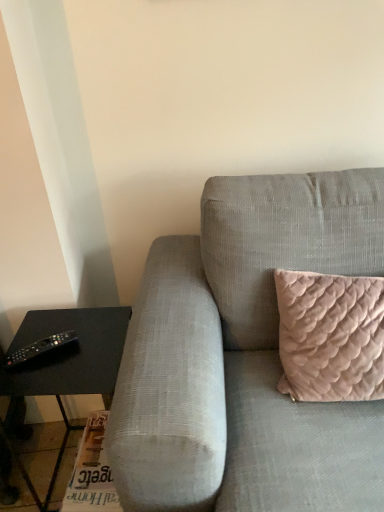
The width and height of the screenshot is (384, 512). What are the coordinates of `black matte table at left` in the screenshot? It's located at (65, 364).

Where is `black matte table at left`? The width and height of the screenshot is (384, 512). black matte table at left is located at coordinates (65, 364).

What's the angular difference between black matte table at left and textured gray couch at center's facing directions?

There is a 0.264-degree angle between the facing directions of black matte table at left and textured gray couch at center.

Find the location of a particular element. This screenshot has width=384, height=512. studio couch lying above the black matte table at left (from the image's perspective) is located at coordinates (245, 356).

Which of these two, black matte table at left or textured gray couch at center, stands taller?

With more height is textured gray couch at center.

From a real-world perspective, is black matte table at left on textured gray couch at center?

Incorrect, from a real-world perspective, black matte table at left is lower than textured gray couch at center.

From a real-world perspective, which is physically above, black plastic remote at lower left or textured gray couch at center?

In real-world perspective, black plastic remote at lower left is above.

Does point (71, 338) appear closer or farther from the camera than point (335, 417)?

Point (71, 338) appears to be farther away from the viewer than point (335, 417).

Can you confirm if black plastic remote at lower left is thinner than textured gray couch at center?

Indeed, black plastic remote at lower left has a lesser width compared to textured gray couch at center.

Are black plastic remote at lower left and textured gray couch at center making contact?

No, black plastic remote at lower left is not making contact with textured gray couch at center.

Does point (68, 340) come behind point (70, 344)?

No.

Is black plastic remote at lower left positioned behind black matte table at left?

Yes, it is behind black matte table at left.

Considering the sizes of black matte table at left and black plastic remote at lower left in the image, is black matte table at left taller or shorter than black plastic remote at lower left?

Considering their sizes, black matte table at left has more height than black plastic remote at lower left.

Are black matte table at left and black plastic remote at lower left making contact?

black matte table at left and black plastic remote at lower left are not in contact.

Based on the photo, is black matte table at left oriented away from black plastic remote at lower left?

black matte table at left is not turned away from black plastic remote at lower left.

Considering the positions of point (38, 362) and point (51, 337), is point (38, 362) closer or farther from the camera than point (51, 337)?

Clearly, point (38, 362) is closer to the camera than point (51, 337).

Could black plastic remote at lower left be considered to be inside textured gray couch at center?

No, textured gray couch at center does not contain black plastic remote at lower left.

Does textured gray couch at center have a lesser width compared to black plastic remote at lower left?

In fact, textured gray couch at center might be wider than black plastic remote at lower left.

Is textured gray couch at center oriented away from black plastic remote at lower left?

No, black plastic remote at lower left is not at the back of textured gray couch at center.

Are textured gray couch at center and black plastic remote at lower left making contact?

No, textured gray couch at center is not making contact with black plastic remote at lower left.

Between point (234, 313) and point (25, 391), which one is positioned in front?

The point (25, 391) is more forward.

Is textured gray couch at center smaller than black matte table at left?

No, textured gray couch at center is not smaller than black matte table at left.

Which is more to the left, textured gray couch at center or black matte table at left?

black matte table at left is more to the left.

From a real-world perspective, does textured gray couch at center stand above black matte table at left?

Correct, in the physical world, textured gray couch at center is higher than black matte table at left.

The image size is (384, 512). In order to click on table on the left of textured gray couch at center in this screenshot , I will do `click(65, 364)`.

Image resolution: width=384 pixels, height=512 pixels. I want to click on remote behind the textured gray couch at center, so click(40, 348).

Considering their positions, is black plastic remote at lower left positioned closer to black matte table at left than textured gray couch at center?

Among the two, black plastic remote at lower left is located nearer to black matte table at left.

Estimate the real-world distances between objects in this image. Which object is closer to black plastic remote at lower left, black matte table at left or textured gray couch at center?

black matte table at left is positioned closer to the anchor black plastic remote at lower left.

Considering their positions, is black matte table at left positioned further to textured gray couch at center than black plastic remote at lower left?

black plastic remote at lower left is further to textured gray couch at center.

From the image, which object appears to be nearer to black plastic remote at lower left, textured gray couch at center or black matte table at left?

black matte table at left.

When comparing their distances from black matte table at left, does textured gray couch at center or black plastic remote at lower left seem further?

textured gray couch at center lies further to black matte table at left than the other object.

Estimate the real-world distances between objects in this image. Which object is further from textured gray couch at center, black plastic remote at lower left or black matte table at left?

The object further to textured gray couch at center is black plastic remote at lower left.

Identify the location of table between black plastic remote at lower left and textured gray couch at center from left to right. (65, 364).